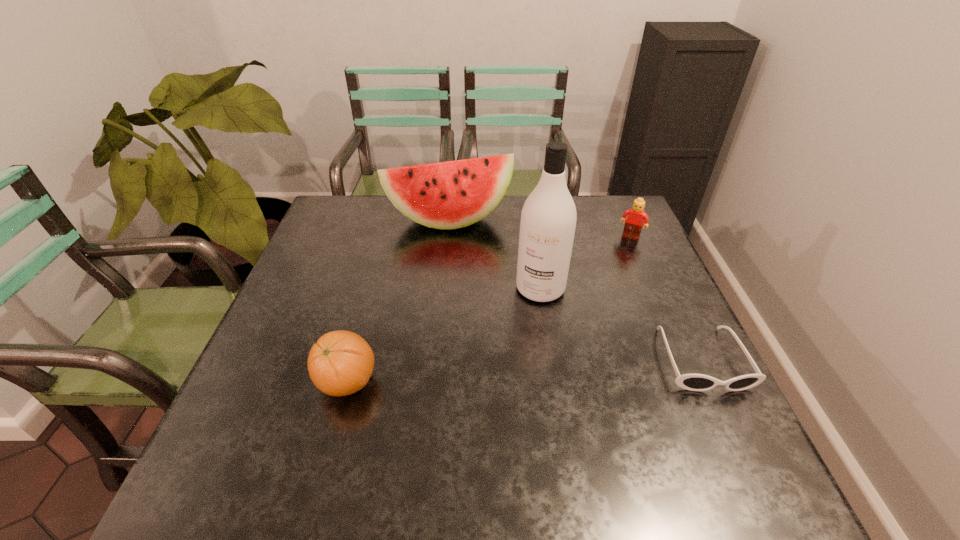
What are the coordinates of `sunglasses located in the right edge section of the desktop` in the screenshot? It's located at (694, 382).

This screenshot has height=540, width=960. Find the location of `Lego located in the right edge section of the desktop`. Lego located in the right edge section of the desktop is located at coordinates (637, 216).

The width and height of the screenshot is (960, 540). What are the coordinates of `object that is at the near left corner` in the screenshot? It's located at (340, 363).

Identify the location of object that is at the far right corner. (637, 216).

Identify the location of vacant space at the far edge of the desktop. (514, 205).

At what (x,y) coordinates should I click in order to perform the action: click on free space at the near edge of the desktop. Please return your answer as a coordinate pair (x, y). This screenshot has height=540, width=960. Looking at the image, I should click on (318, 428).

Where is `vacant space at the left edge`? This screenshot has width=960, height=540. vacant space at the left edge is located at coordinates (313, 302).

You are a GUI agent. You are given a task and a screenshot of the screen. Output one action in this format:
    pyautogui.click(x=<x>, y=<y>)
    Task: Click on the vacant space at the right edge of the desktop
    The height and width of the screenshot is (540, 960).
    Given the screenshot: What is the action you would take?
    pyautogui.click(x=645, y=301)

Where is `vacant space at the far left corner of the desktop`? vacant space at the far left corner of the desktop is located at coordinates (334, 197).

The height and width of the screenshot is (540, 960). What are the coordinates of `vacant point at the near left corner` in the screenshot? It's located at (238, 434).